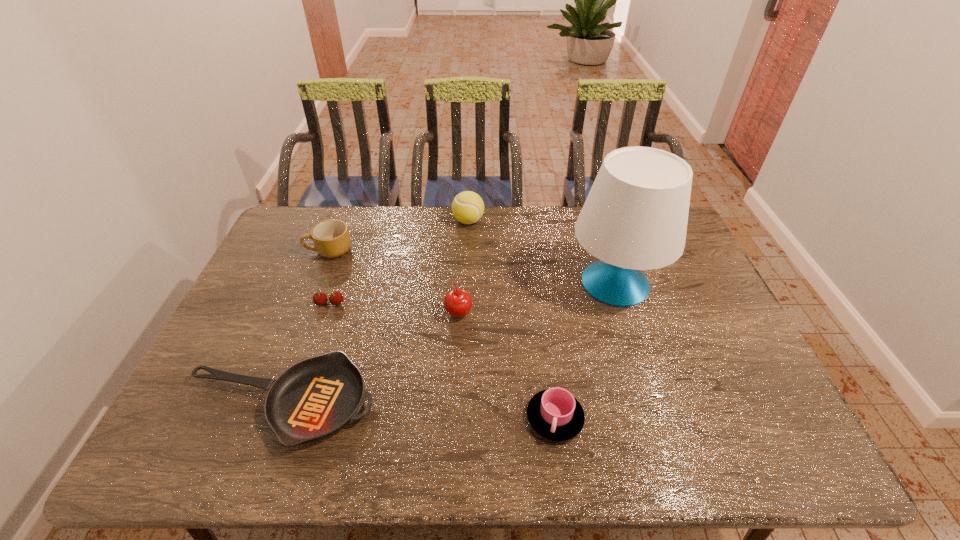
Where is `vacant space in between the rightmost object and the sixth object from left to right`? The height and width of the screenshot is (540, 960). vacant space in between the rightmost object and the sixth object from left to right is located at coordinates [585, 350].

Locate an element on the screen. The height and width of the screenshot is (540, 960). blank region between the right cherry and the mug is located at coordinates (394, 281).

Where is `vacant area between the tennis ball and the shortest object`? This screenshot has height=540, width=960. vacant area between the tennis ball and the shortest object is located at coordinates (374, 312).

This screenshot has height=540, width=960. Identify the location of the fourth closest object to the right cherry. (335, 298).

Locate an element on the screen. The image size is (960, 540). object that is the fourth closest to the frying pan is located at coordinates (331, 238).

Find the location of a particular element. The image size is (960, 540). free spot that satisfies the following two spatial constraints: 1. on the back side of the farthest object; 2. on the right side of the shortest object is located at coordinates (348, 221).

Locate an element on the screen. The width and height of the screenshot is (960, 540). vacant area in the image that satisfies the following two spatial constraints: 1. on the surface of the right cherry; 2. on the right side of the left cherry is located at coordinates (327, 312).

Find the location of `vacant space that satisfies the following two spatial constraints: 1. on the surface of the right cherry; 2. on the right side of the left cherry`. vacant space that satisfies the following two spatial constraints: 1. on the surface of the right cherry; 2. on the right side of the left cherry is located at coordinates (327, 312).

You are a GUI agent. You are given a task and a screenshot of the screen. Output one action in this format:
    pyautogui.click(x=<x>, y=<y>)
    Task: Click on the vacant position in the image that satisfies the following two spatial constraints: 1. on the front-facing side of the table lamp; 2. on the surface of the left cherry
    
    Given the screenshot: What is the action you would take?
    pyautogui.click(x=622, y=304)

Locate an element on the screen. The height and width of the screenshot is (540, 960). free spot that satisfies the following two spatial constraints: 1. on the side with the handle of the mug; 2. on the right side of the farthest object is located at coordinates (341, 221).